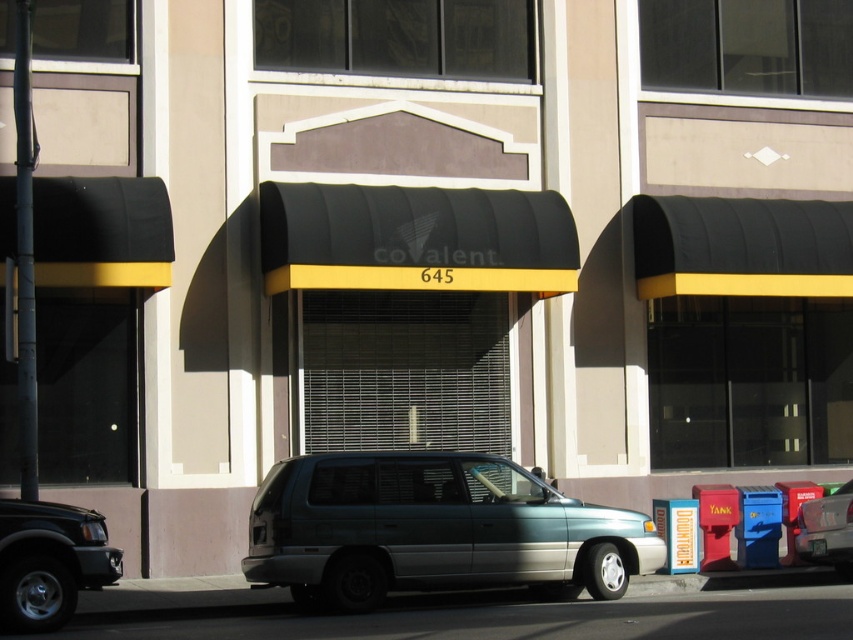
Which of these two, teal matte minivan at center or matte black suv at lower left, stands taller?

With more height is teal matte minivan at center.

Is point (512, 580) closer to camera compared to point (71, 547)?

That is False.

Locate an element on the screen. The height and width of the screenshot is (640, 853). teal matte minivan at center is located at coordinates (433, 531).

Can you confirm if matte black suv at lower left is thinner than metallic silver minivan at center?

No.

From the picture: Who is more distant from viewer, (36, 608) or (840, 513)?

Positioned behind is point (840, 513).

Who is more distant from viewer, (32, 579) or (851, 548)?

The point (851, 548) is more distant.

At what (x,y) coordinates should I click in order to perform the action: click on matte black suv at lower left. Please return your answer as a coordinate pair (x, y). This screenshot has height=640, width=853. Looking at the image, I should click on (49, 561).

Does teal matte minivan at center have a larger size compared to metallic silver minivan at center?

Result: Yes, teal matte minivan at center is bigger than metallic silver minivan at center.

Which is behind, point (364, 472) or point (840, 500)?

Positioned behind is point (840, 500).

What do you see at coordinates (433, 531) in the screenshot?
I see `teal matte minivan at center` at bounding box center [433, 531].

The height and width of the screenshot is (640, 853). Identify the location of teal matte minivan at center. (433, 531).